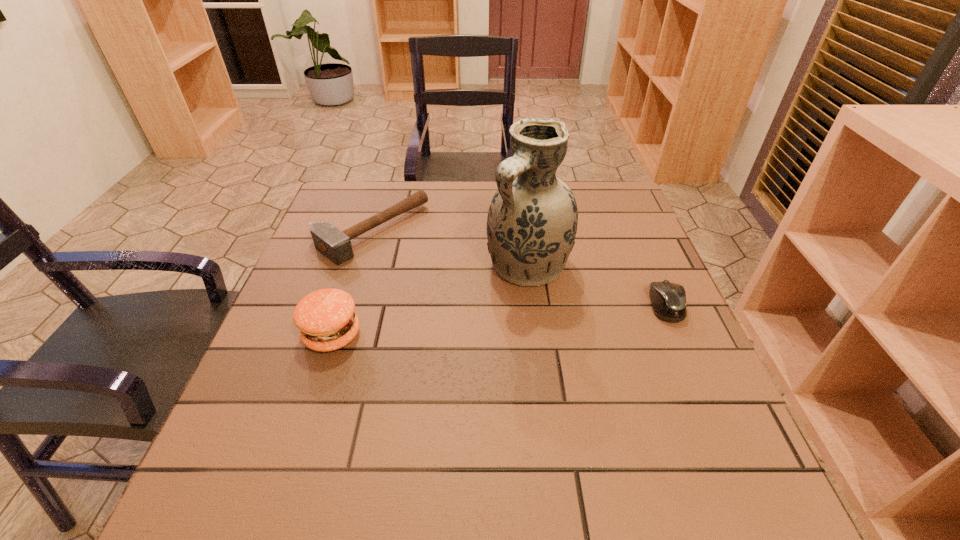
Where is `vacant space at the right edge of the desktop`? The width and height of the screenshot is (960, 540). vacant space at the right edge of the desktop is located at coordinates [x=667, y=353].

At what (x,y) coordinates should I click in order to perform the action: click on free space at the far right corner of the desktop. Please return your answer as a coordinate pair (x, y). Looking at the image, I should click on (607, 214).

In the image, there is a desktop. What are the coordinates of `vacant region at the near right corner` in the screenshot? It's located at (694, 445).

I want to click on free space between the third shortest object and the second object from right to left, so click(x=430, y=300).

Locate an element on the screen. The height and width of the screenshot is (540, 960). free area in between the hammer and the third object from left to right is located at coordinates pyautogui.click(x=450, y=248).

At what (x,y) coordinates should I click in order to perform the action: click on free spot between the vase and the mouse. Please return your answer as a coordinate pair (x, y). Image resolution: width=960 pixels, height=540 pixels. Looking at the image, I should click on (597, 285).

Where is `vacant area that lies between the hammer and the patty`? Image resolution: width=960 pixels, height=540 pixels. vacant area that lies between the hammer and the patty is located at coordinates (352, 283).

This screenshot has height=540, width=960. I want to click on vacant region between the second tallest object and the vase, so click(430, 300).

The height and width of the screenshot is (540, 960). Find the location of `free spot between the third object from left to right and the rightmost object`. free spot between the third object from left to right and the rightmost object is located at coordinates (597, 285).

I want to click on empty space between the third object from left to right and the mouse, so click(597, 285).